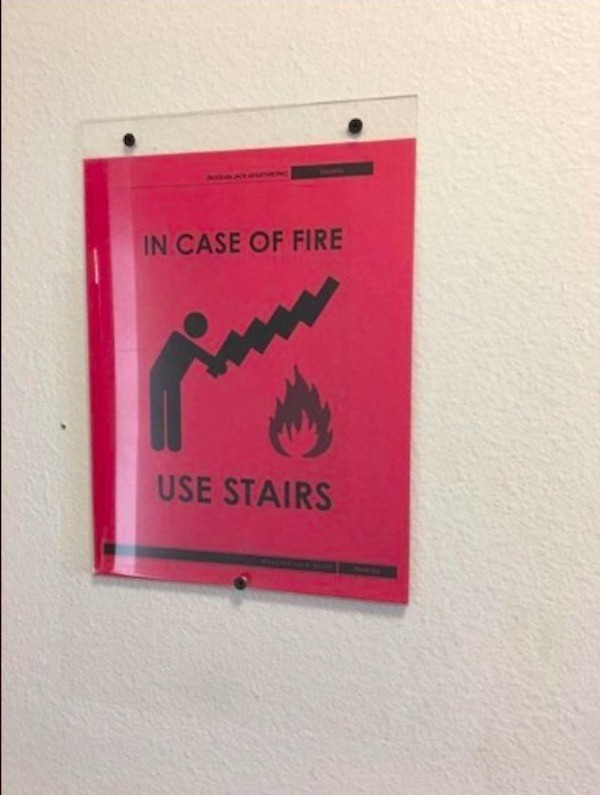
Where is `wall`? wall is located at coordinates (511, 467).